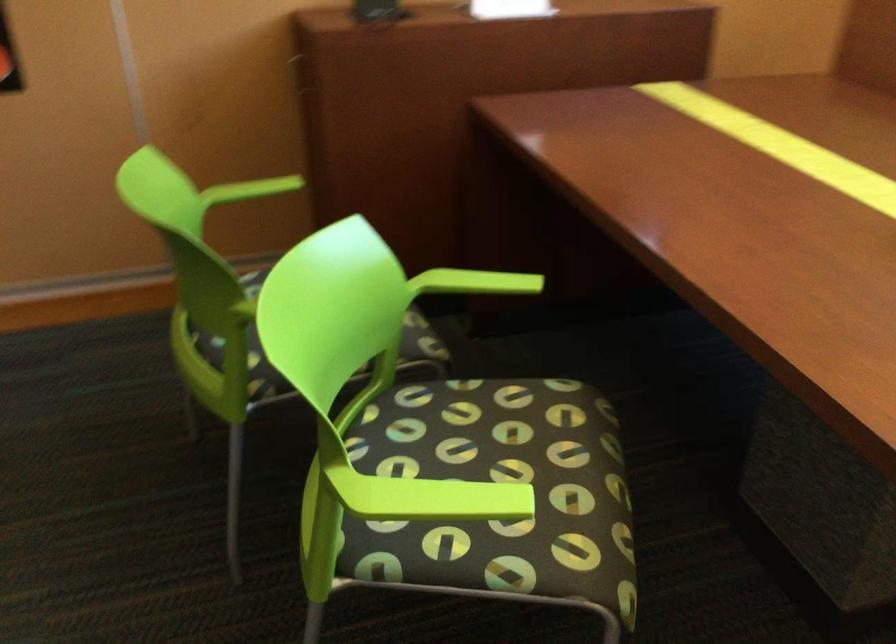
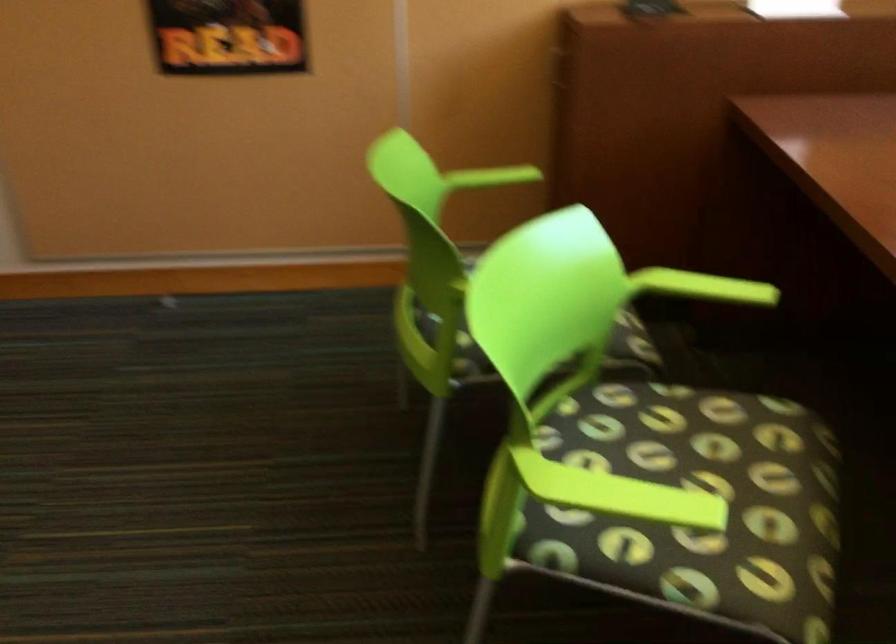
Question: The images are taken continuously from a first-person perspective. In which direction are you moving?

Choices:
 (A) Left
 (B) Right
 (C) Forward
 (D) Backward

Answer: (B)